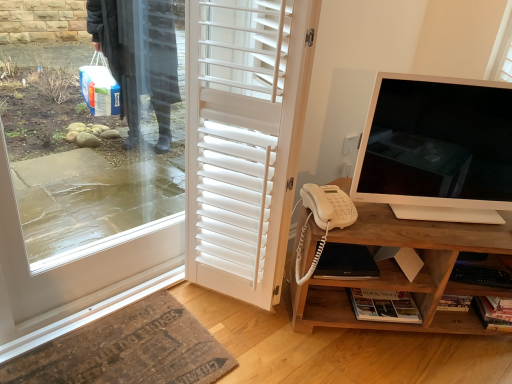
The height and width of the screenshot is (384, 512). Describe the element at coordinates (403, 273) in the screenshot. I see `wooden cabinet at right` at that location.

Image resolution: width=512 pixels, height=384 pixels. Describe the element at coordinates (346, 263) in the screenshot. I see `black matte laptop at lower center` at that location.

Locate an element on the screen. wooden cabinet at right is located at coordinates (403, 273).

From a real-world perspective, between white glossy monitor at right and wooden cabinet at right, who is vertically higher?

In real-world perspective, white glossy monitor at right is above.

Is white glossy monitor at right aimed at wooden cabinet at right?

No, white glossy monitor at right is not aimed at wooden cabinet at right.

Would you say white glossy monitor at right is to the left or to the right of wooden cabinet at right in the picture?

Based on their positions, white glossy monitor at right is located to the right of wooden cabinet at right.

Who is smaller, white glossy monitor at right or wooden cabinet at right?

Smaller between the two is white glossy monitor at right.

Which is farther, (416, 303) or (168, 353)?

Point (416, 303)

Which is correct: wooden cabinet at right is inside rug at lower left, or outside of it?

wooden cabinet at right is located beyond the bounds of rug at lower left.

Is wooden cabinet at right next to rug at lower left?

No, wooden cabinet at right is not in contact with rug at lower left.

Between wooden cabinet at right and rug at lower left, which one appears on the right side from the viewer's perspective?

Positioned to the right is wooden cabinet at right.

Between wooden cabinet at right and black matte laptop at lower center, which one has smaller size?

black matte laptop at lower center.

Are wooden cabinet at right and black matte laptop at lower center making contact?

No, wooden cabinet at right is not next to black matte laptop at lower center.

Is black matte laptop at lower center completely or partially inside wooden cabinet at right?

Indeed, black matte laptop at lower center is located within wooden cabinet at right.

Considering the points (474, 247) and (356, 272), which point is in front, point (474, 247) or point (356, 272)?

The point (474, 247) is in front.

Is black matte laptop at lower center at the back of white glossy monitor at right?

No, white glossy monitor at right is not facing away from black matte laptop at lower center.

From the image's perspective, which one is positioned higher, white glossy monitor at right or black matte laptop at lower center?

From the image's view, white glossy monitor at right is above.

Considering the relative sizes of white glossy monitor at right and black matte laptop at lower center in the image provided, is white glossy monitor at right wider than black matte laptop at lower center?

No.

Can we say white glossy monitor at right lies outside black matte laptop at lower center?

white glossy monitor at right is positioned outside black matte laptop at lower center.

From a real-world perspective, which is physically below, white matte door at center or rug at lower left?

rug at lower left, from a real-world perspective.

Does white matte door at center come in front of rug at lower left?

No, white matte door at center is behind rug at lower left.

Can you tell me how much white matte door at center and rug at lower left differ in facing direction?

The angle between the facing direction of white matte door at center and the facing direction of rug at lower left is 11.9 degrees.

Based on the photo, can we say white matte door at center lies outside rug at lower left?

white matte door at center lies outside rug at lower left's area.

Consider the image. Is wooden cabinet at right closer to the viewer compared to white matte door at center?

That is False.

From a real-world perspective, is wooden cabinet at right beneath white matte door at center?

Yes, from a real-world perspective, wooden cabinet at right is under white matte door at center.

Is wooden cabinet at right bigger or smaller than white matte door at center?

wooden cabinet at right is bigger than white matte door at center.

Does point (504, 216) appear closer or farther from the camera than point (222, 209)?

Point (504, 216) appears to be closer to the viewer than point (222, 209).

Considering the points (55, 369) and (365, 249), which point is in front, point (55, 369) or point (365, 249)?

The point (55, 369) is closer to the camera.

Considering the relative positions of rug at lower left and black matte laptop at lower center in the image provided, is rug at lower left behind black matte laptop at lower center?

No, it is in front of black matte laptop at lower center.

Are rug at lower left and black matte laptop at lower center making contact?

No, rug at lower left is not touching black matte laptop at lower center.

Where is `laptop lying behind the rug at lower left`? laptop lying behind the rug at lower left is located at coordinates (346, 263).

I want to click on television above the wooden cabinet at right (from a real-world perspective), so click(437, 149).

Locate an element on the screen. cabinetry lying above the rug at lower left (from the image's perspective) is located at coordinates (403, 273).

Looking at this image, considering their positions, is black matte laptop at lower center positioned further to white matte door at center than white glossy monitor at right?

white glossy monitor at right lies further to white matte door at center than the other object.

Considering their positions, is black matte laptop at lower center positioned further to white matte door at center than rug at lower left?

Based on the image, rug at lower left appears to be further to white matte door at center.

From the image, which object appears to be farther from black matte laptop at lower center, rug at lower left or white glossy monitor at right?

rug at lower left is further to black matte laptop at lower center.

Estimate the real-world distances between objects in this image. Which object is closer to black matte laptop at lower center, wooden cabinet at right or white matte door at center?

wooden cabinet at right is positioned closer to the anchor black matte laptop at lower center.

Looking at the image, which one is located closer to wooden cabinet at right, rug at lower left or white matte door at center?

Based on the image, white matte door at center appears to be nearer to wooden cabinet at right.

Looking at the image, which one is located closer to white glossy monitor at right, white matte door at center or black matte laptop at lower center?

Based on the image, black matte laptop at lower center appears to be nearer to white glossy monitor at right.

Based on their spatial positions, is black matte laptop at lower center or wooden cabinet at right further from white matte door at center?

black matte laptop at lower center lies further to white matte door at center than the other object.

Looking at the image, which one is located further to white glossy monitor at right, black matte laptop at lower center or rug at lower left?

Based on the image, rug at lower left appears to be further to white glossy monitor at right.

Identify the location of laptop between white matte door at center and white glossy monitor at right in the horizontal direction. (346, 263).

Locate an element on the screen. door between rug at lower left and black matte laptop at lower center from left to right is located at coordinates (244, 139).

The height and width of the screenshot is (384, 512). Find the location of `laptop between white glossy monitor at right and wooden cabinet at right from top to bottom`. laptop between white glossy monitor at right and wooden cabinet at right from top to bottom is located at coordinates (346, 263).

At what (x,y) coordinates should I click in order to perform the action: click on laptop between rug at lower left and wooden cabinet at right from left to right. Please return your answer as a coordinate pair (x, y). This screenshot has width=512, height=384. Looking at the image, I should click on (346, 263).